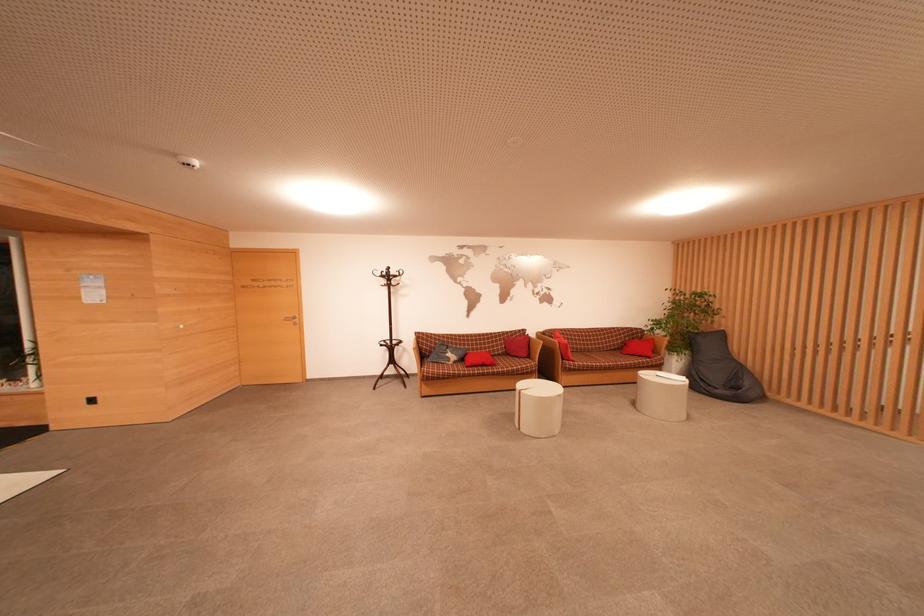
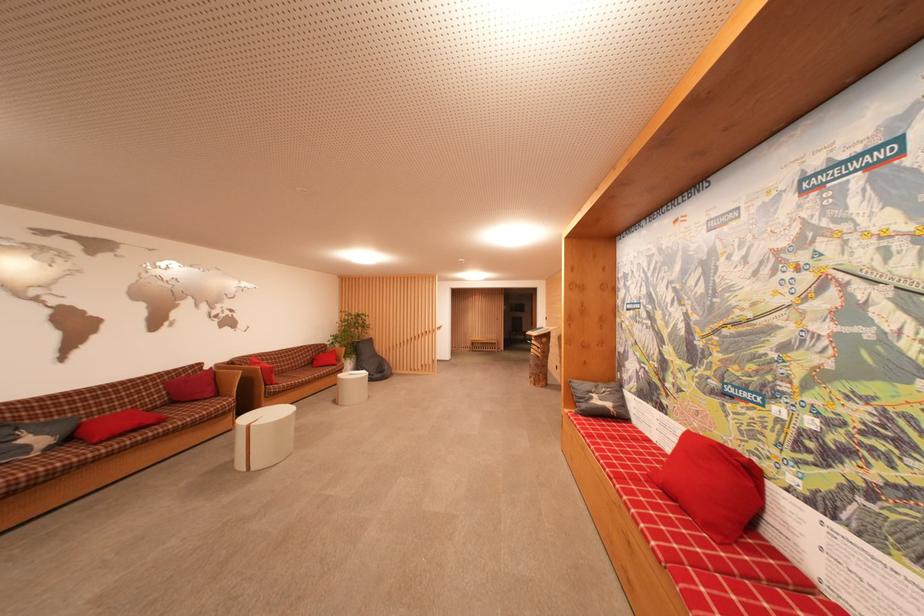
Locate, in the second image, the point that corresponds to [480,352] in the first image.

(104, 415)